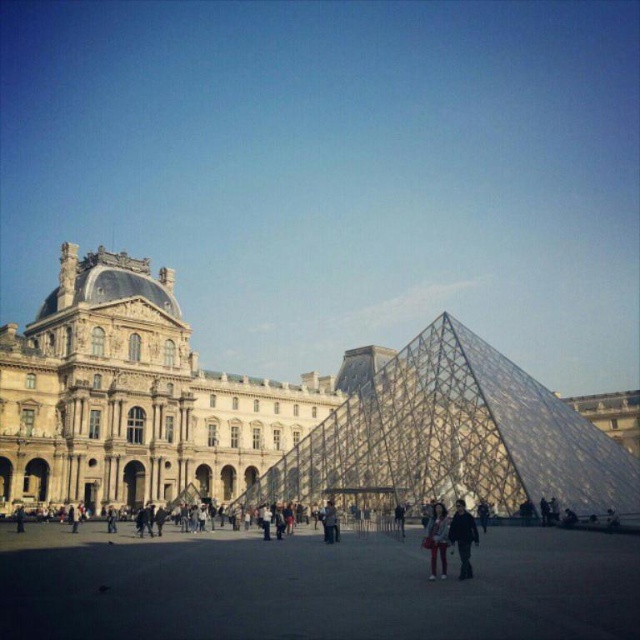
Question: Is golden stone palace at center to the left of transparent glass pyramid at center from the viewer's perspective?

Choices:
 (A) no
 (B) yes

Answer: (B)

Question: Can you confirm if golden stone palace at center is thinner than dark brown leather jacket at center?

Choices:
 (A) no
 (B) yes

Answer: (A)

Question: Which point is farther from the camera taking this photo?

Choices:
 (A) (401, 422)
 (B) (333, 540)
 (C) (452, 540)
 (D) (16, 513)

Answer: (A)

Question: Considering the relative positions of denim jacket at lower center and light brown leather jacket at center in the image provided, where is denim jacket at lower center located with respect to light brown leather jacket at center?

Choices:
 (A) right
 (B) left

Answer: (A)

Question: Which of these objects is positioned closest to the dark gray concrete plaza at center?

Choices:
 (A) transparent glass pyramid at center
 (B) dark brown leather jacket at center

Answer: (B)

Question: Among these points, which one is farthest from the camera?

Choices:
 (A) (109, 266)
 (B) (419, 337)
 (C) (435, 566)
 (D) (257, 544)

Answer: (B)